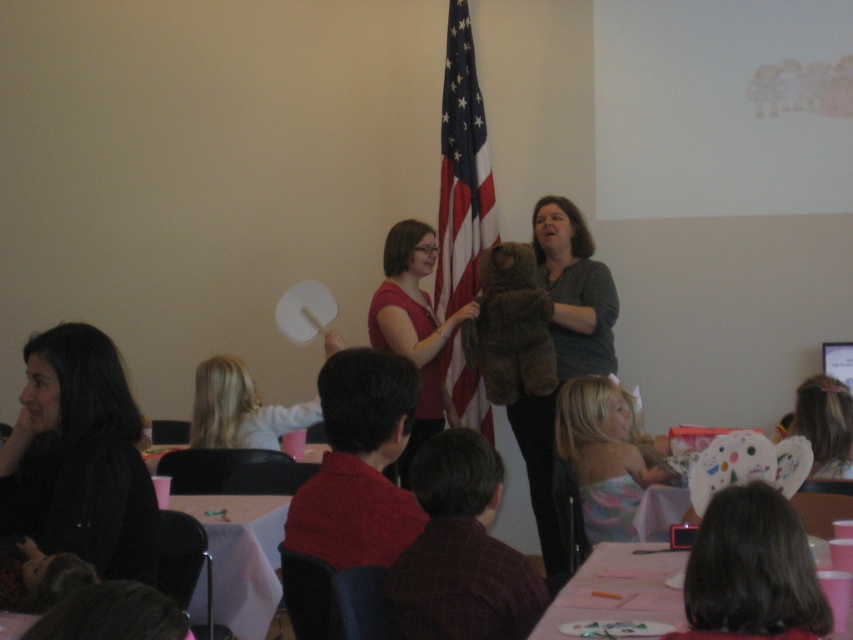
Is pastel striped dress at lower center in front of matte white paper plate at lower right?

That is False.

Does pastel striped dress at lower center appear over matte white paper plate at lower right?

Incorrect, pastel striped dress at lower center is not positioned above matte white paper plate at lower right.

Is point (619, 445) farther from viewer compared to point (809, 435)?

Yes, point (619, 445) is farther from viewer.

Where is `pastel striped dress at lower center`? The image size is (853, 640). pastel striped dress at lower center is located at coordinates (602, 456).

Can you confirm if american flag at center is thinner than matte white paper plate at lower right?

In fact, american flag at center might be wider than matte white paper plate at lower right.

Does point (485, 244) come closer to viewer compared to point (799, 419)?

No, (485, 244) is behind (799, 419).

Does point (448, 179) lie behind point (824, 426)?

Yes, it is.

Locate an element on the screen. american flag at center is located at coordinates (461, 172).

Is point (567, 323) less distant than point (625, 461)?

No.

Locate an element on the screen. This screenshot has width=853, height=640. gray soft teddy bear at center is located at coordinates (573, 289).